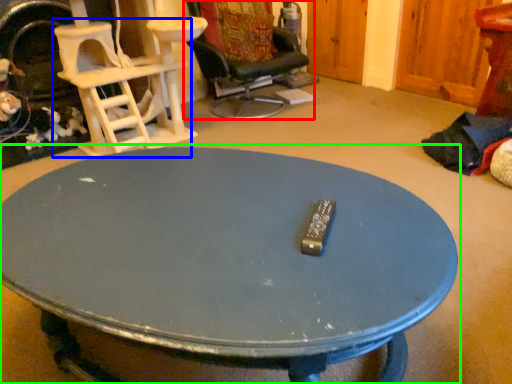
Question: Which object is the farthest from chair (highlighted by a red box)? Choose among these: chair (highlighted by a blue box) or coffee table (highlighted by a green box).

Choices:
 (A) chair
 (B) coffee table

Answer: (B)